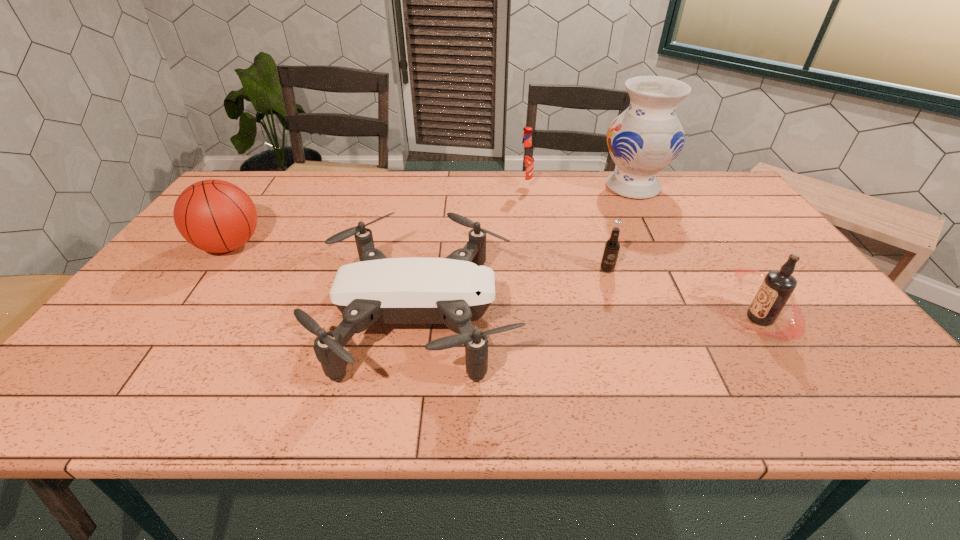
This screenshot has width=960, height=540. In order to click on free space between the tallest object and the fourth object from right to left in this screenshot , I will do `click(578, 187)`.

Locate an element on the screen. This screenshot has height=540, width=960. free space that is in between the rightmost root beer and the second object from left to right is located at coordinates (590, 319).

I want to click on object that is the second closest to the vase, so click(612, 246).

You are a GUI agent. You are given a task and a screenshot of the screen. Output one action in this format:
    pyautogui.click(x=<x>, y=<y>)
    Task: Click on the object that can be found as the third closest to the leftmost object
    This screenshot has width=960, height=540.
    Given the screenshot: What is the action you would take?
    pyautogui.click(x=612, y=246)

Where is `the closest root beer to the fifth object from right to left`? This screenshot has width=960, height=540. the closest root beer to the fifth object from right to left is located at coordinates [x=612, y=246].

You are a GUI agent. You are given a task and a screenshot of the screen. Output one action in this format:
    pyautogui.click(x=<x>, y=<y>)
    Task: Click on the root beer identified as the third closest to the leftmost object
    This screenshot has height=540, width=960.
    Given the screenshot: What is the action you would take?
    pyautogui.click(x=778, y=285)

Find the location of `free point that satisfies the following two spatial constraints: 1. on the label of the second nearest root beer; 2. on the camera side of the drone`. free point that satisfies the following two spatial constraints: 1. on the label of the second nearest root beer; 2. on the camera side of the drone is located at coordinates (624, 319).

This screenshot has height=540, width=960. In order to click on free location that satisfies the following two spatial constraints: 1. on the front side of the vase; 2. on the right side of the fourth object from right to left in this screenshot , I will do `click(524, 187)`.